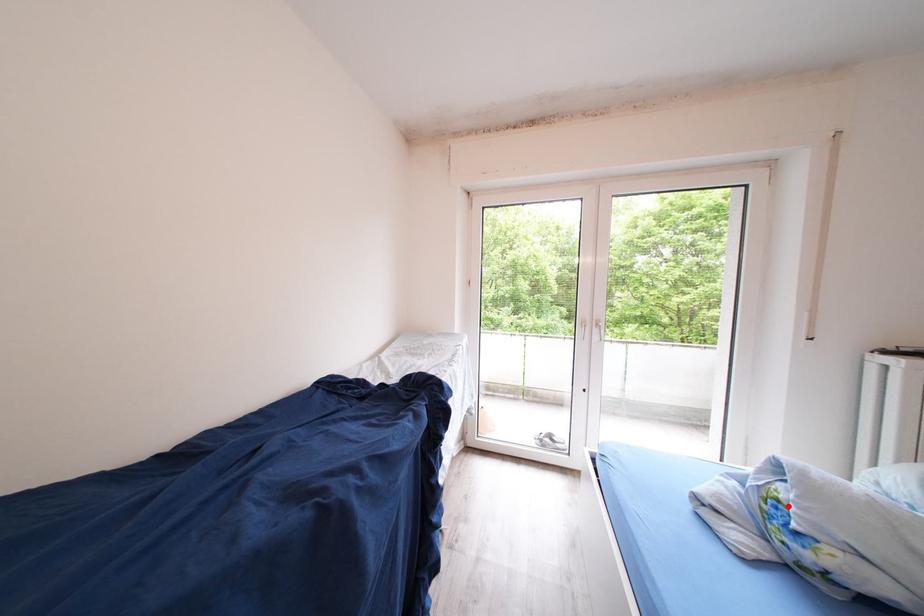
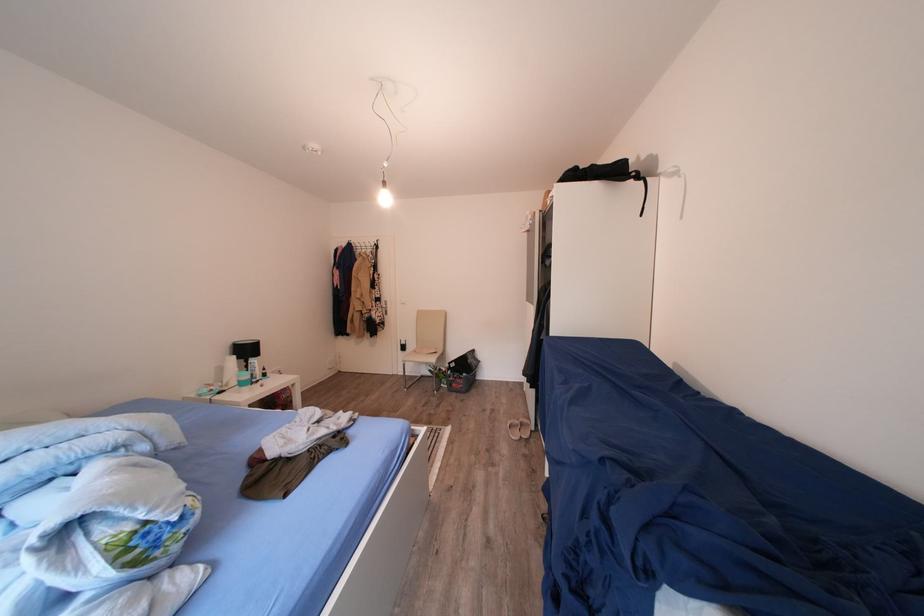
Where in the second image is the point corresponding to the highlighted location from the first image?

(142, 538)